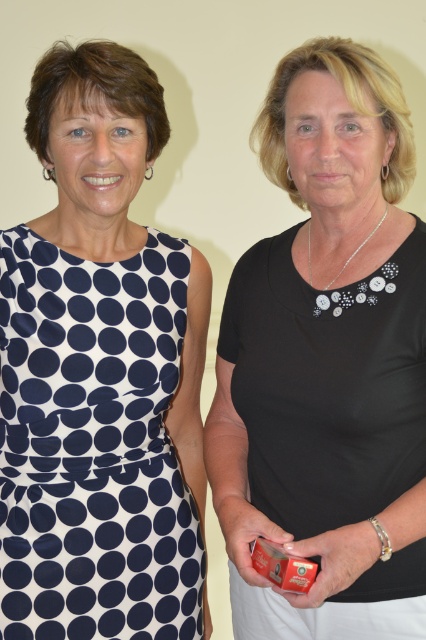
Is black matte shirt at center below navy blue polka dot fabric dress at left?

No.

Who is taller, black matte shirt at center or navy blue polka dot fabric dress at left?

black matte shirt at center is taller.

Is point (363, 212) farther from camera compared to point (149, 284)?

No, (363, 212) is closer to viewer.

The width and height of the screenshot is (426, 640). I want to click on black matte shirt at center, so click(327, 362).